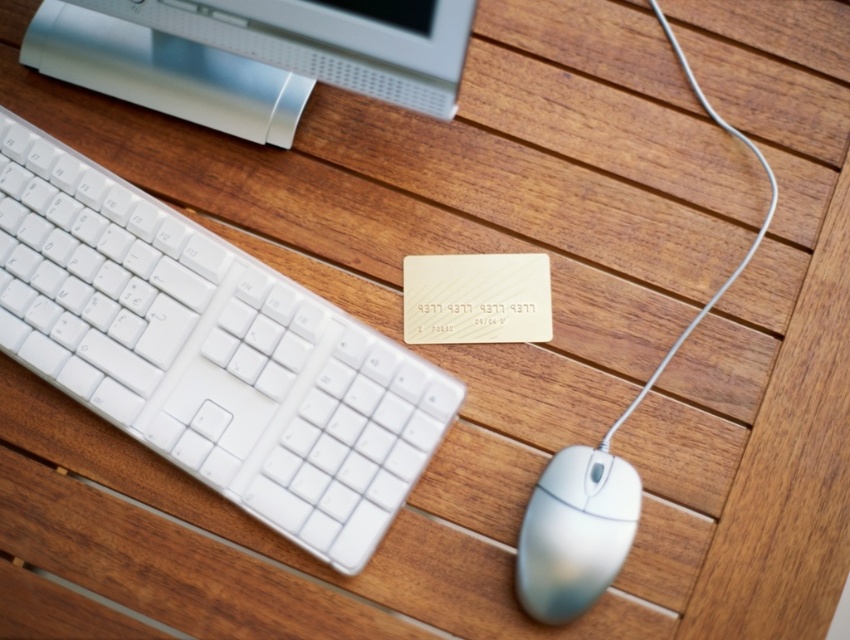
Question: Among these points, which one is farthest from the camera?

Choices:
 (A) (559, 528)
 (B) (40, 17)

Answer: (B)

Question: In this image, where is white plastic keyboard at upper left located relative to satin silver monitor at upper left?

Choices:
 (A) left
 (B) right

Answer: (A)

Question: Is satin silver monitor at upper left above white plastic mouse at lower right?

Choices:
 (A) no
 (B) yes

Answer: (B)

Question: Is white plastic keyboard at upper left thinner than white plastic mouse at lower right?

Choices:
 (A) no
 (B) yes

Answer: (A)

Question: Which point is closer to the camera?

Choices:
 (A) white plastic mouse at lower right
 (B) white plastic keyboard at upper left
 (C) satin silver monitor at upper left

Answer: (C)

Question: Which object is positioned closest to the white plastic mouse at lower right?

Choices:
 (A) white plastic keyboard at upper left
 (B) satin silver monitor at upper left

Answer: (A)